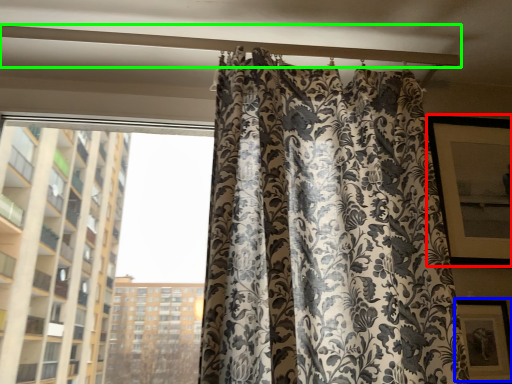
Question: Which object is the farthest from window screen (highlighted by a red box)? Choose among these: picture frame (highlighted by a blue box) or beam (highlighted by a green box).

Choices:
 (A) picture frame
 (B) beam

Answer: (B)